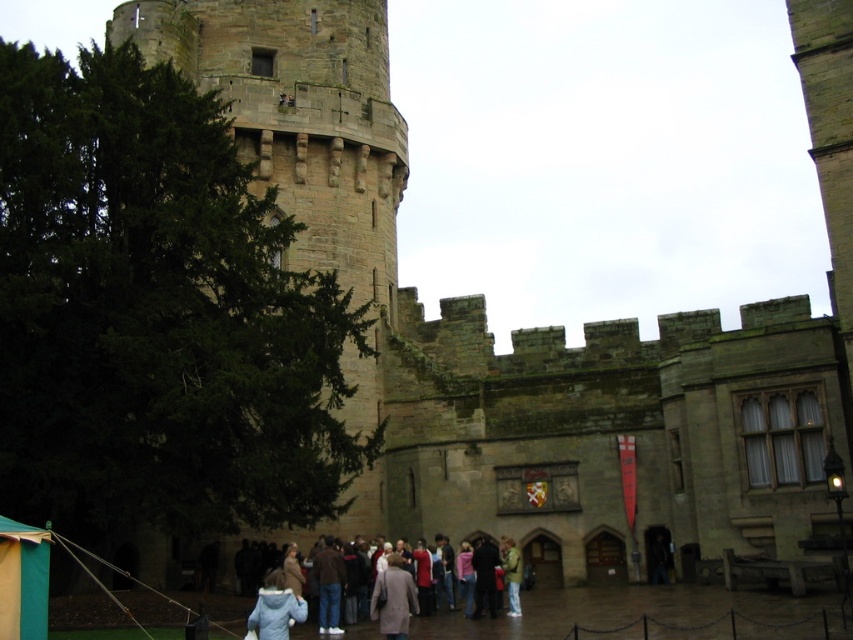
Which of these two, brown stone tower at left or light blue denim jacket at lower center, stands taller?

With more height is brown stone tower at left.

Is brown stone tower at left bigger than light blue denim jacket at lower center?

Correct, brown stone tower at left is larger in size than light blue denim jacket at lower center.

The width and height of the screenshot is (853, 640). Describe the element at coordinates (300, 116) in the screenshot. I see `brown stone tower at left` at that location.

This screenshot has height=640, width=853. In order to click on brown stone tower at left in this screenshot , I will do `click(300, 116)`.

Is brown stone tower at left to the right of light brown leather jacket at center from the viewer's perspective?

No, brown stone tower at left is not to the right of light brown leather jacket at center.

Who is taller, brown stone tower at left or light brown leather jacket at center?

brown stone tower at left is taller.

Which is in front, point (111, 35) or point (508, 552)?

Point (508, 552) is more forward.

You are a GUI agent. You are given a task and a screenshot of the screen. Output one action in this format:
    pyautogui.click(x=<x>, y=<y>)
    Task: Click on the brown stone tower at left
    This screenshot has width=853, height=640.
    Given the screenshot: What is the action you would take?
    pyautogui.click(x=300, y=116)

Is light blue denim jacket at lower center positioned at the back of light gray wool coat at center?

No, it is not.

Where is `light blue denim jacket at lower center`? light blue denim jacket at lower center is located at coordinates (405, 609).